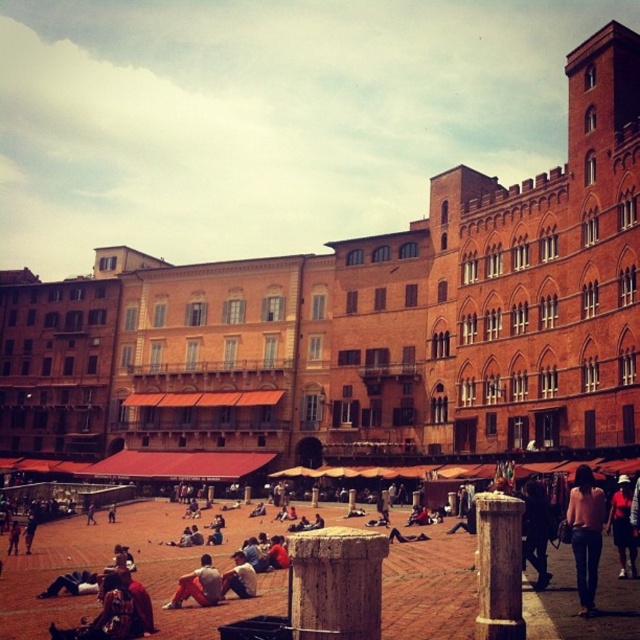
Between black leather jacket at lower right and light brown leather jacket at center, which one is positioned higher?

black leather jacket at lower right

Which is more to the left, black leather jacket at lower right or light brown leather jacket at center?

Positioned to the left is light brown leather jacket at center.

Locate an element on the screen. Image resolution: width=640 pixels, height=640 pixels. black leather jacket at lower right is located at coordinates (536, 531).

Can you confirm if denim jeans at lower right is positioned to the left of orange cotton pants at lower left?

Incorrect, denim jeans at lower right is not on the left side of orange cotton pants at lower left.

Describe the element at coordinates (586, 534) in the screenshot. I see `denim jeans at lower right` at that location.

Where is `denim jeans at lower right`? The height and width of the screenshot is (640, 640). denim jeans at lower right is located at coordinates (586, 534).

Can you confirm if matte red shirt at center is positioned to the left of orange cotton pants at lower left?

In fact, matte red shirt at center is to the right of orange cotton pants at lower left.

Find the location of a particular element. The height and width of the screenshot is (640, 640). matte red shirt at center is located at coordinates (621, 528).

The width and height of the screenshot is (640, 640). Identify the location of matte red shirt at center. (621, 528).